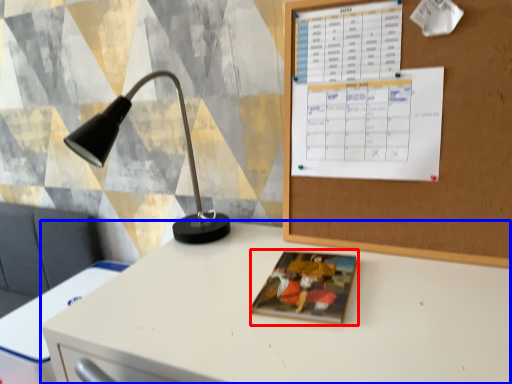
Question: Among these objects, which one is nearest to the camera, book cover (highlighted by a red box) or desk (highlighted by a blue box)?

Choices:
 (A) book cover
 (B) desk

Answer: (B)